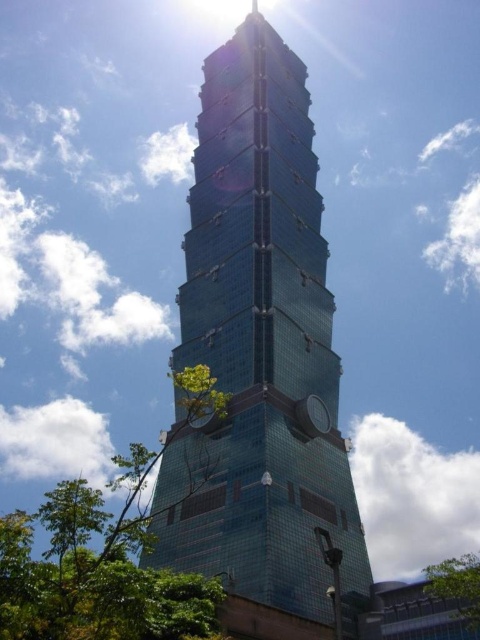
You are standing at point (0,548) and want to reach the top of the skyscraper. Considering the distance between you and the base of the skyscraper is 127.27 feet, and the skyscraper has 50 floors each 12 feet tall, how many total feet will you climb to reach the top?

The total distance to climb is 50 floors multiplied by 12 feet per floor, totaling 600 feet. However, you are already 127.27 feet away from the base, so the total feet to reach the top would be 600 feet plus 127.27 feet, totaling 727.27 feet.

You are standing in front of the skyscraper and want to take a photo that includes both the green leafy tree at lower left and the green leafy tree at lower right. Which tree should you position closer to the camera to ensure both are in the frame?

You should position the green leafy tree at lower left closer to the camera because it is already in front of the green leafy tree at lower right, so adjusting its position would help frame both effectively.

You are standing at the exact center of the image. You want to walk directly towards the glassy blue skyscraper at center. Which direction should you move?

Since the glassy blue skyscraper at center is already at the center point of the image, you are already facing it directly. Move straight ahead.